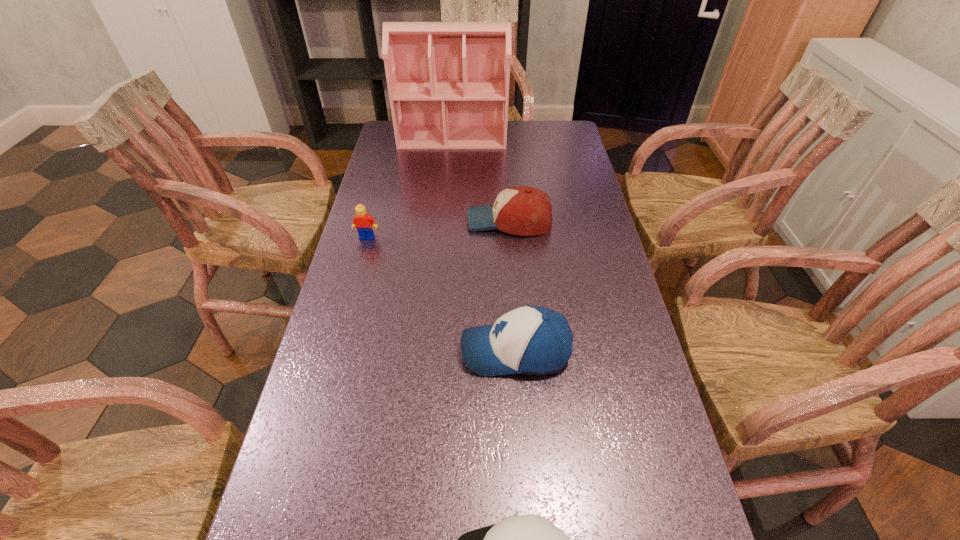
The width and height of the screenshot is (960, 540). Identify the location of vacant space located on the front-facing side of the farthest baseball cap. (404, 221).

Where is `vacant space positioned on the front-facing side of the farthest baseball cap`? vacant space positioned on the front-facing side of the farthest baseball cap is located at coordinates (438, 221).

Find the location of a particular element. vacant space located 0.140m on the face of the Lego is located at coordinates (357, 275).

In order to click on object positioned at the far edge in this screenshot , I will do `click(448, 82)`.

The width and height of the screenshot is (960, 540). What are the coordinates of `dollhouse situated at the left edge` in the screenshot? It's located at pyautogui.click(x=448, y=82).

At what (x,y) coordinates should I click in order to perform the action: click on Lego at the left edge. Please return your answer as a coordinate pair (x, y). This screenshot has height=540, width=960. Looking at the image, I should click on (362, 221).

Locate an element on the screen. This screenshot has height=540, width=960. object situated at the far left corner is located at coordinates (448, 82).

Locate an element on the screen. vacant space at the far edge of the desktop is located at coordinates (525, 132).

Identify the location of blank space at the left edge of the desktop. The width and height of the screenshot is (960, 540). point(328,518).

This screenshot has height=540, width=960. Identify the location of vacant area at the right edge. (592, 288).